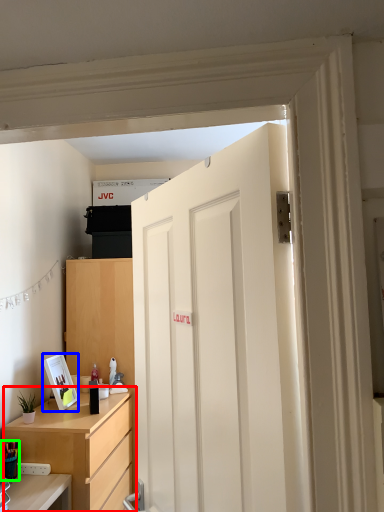
Question: Which object is positioned closest to cabinetry (highlighted by a red box)? Select from picture frame (highlighted by a blue box) and stationery (highlighted by a green box).

Choices:
 (A) picture frame
 (B) stationery

Answer: (A)